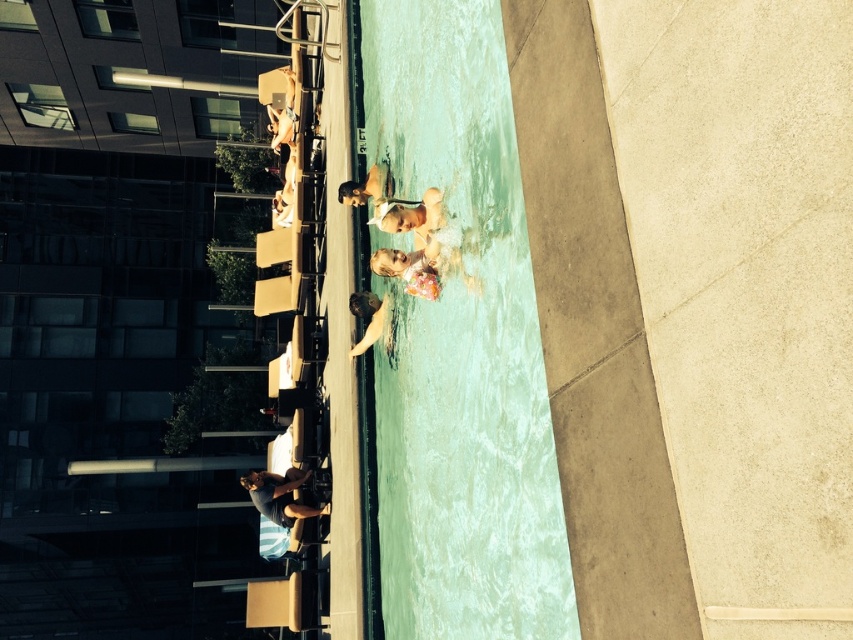
Question: Can you confirm if smooth skin child at center is positioned above light brown wooden chair at upper center?

Choices:
 (A) no
 (B) yes

Answer: (A)

Question: Which point is closer to the camera?

Choices:
 (A) (277, 140)
 (B) (440, 288)
 (C) (389, 332)
 (D) (410, 579)

Answer: (B)

Question: Does dark blue fabric chair at lower center appear on the right side of light brown wooden chair at upper center?

Choices:
 (A) yes
 (B) no

Answer: (A)

Question: Which object is the closest to the smooth skin child at center?

Choices:
 (A) dark blue fabric chair at lower center
 (B) smooth tan skin at center
 (C) white cotton baby at upper center

Answer: (C)

Question: Can you confirm if smooth skin child at center is smaller than light brown wooden chair at upper center?

Choices:
 (A) yes
 (B) no

Answer: (A)

Question: Among these points, which one is nearest to the camera?

Choices:
 (A) (372, 292)
 (B) (432, 291)

Answer: (B)